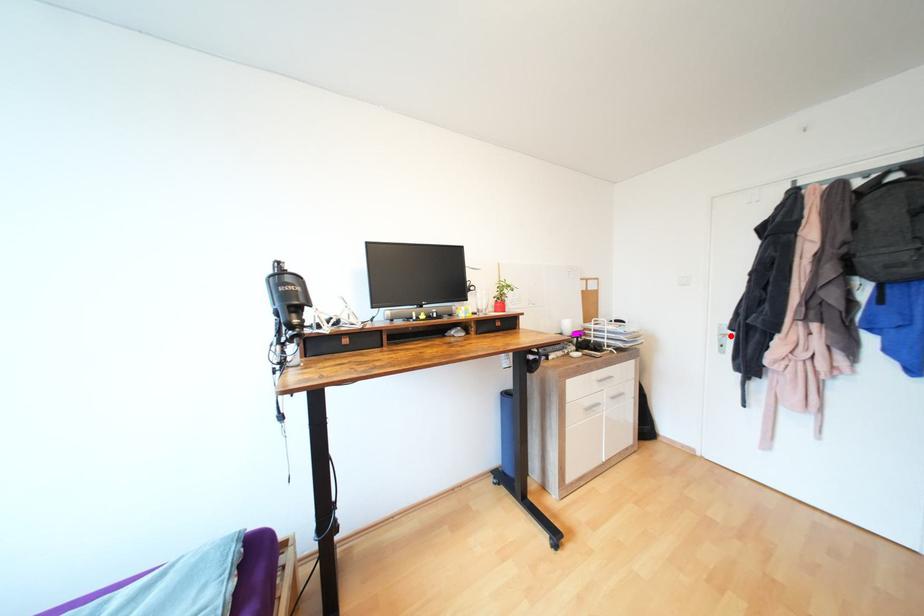
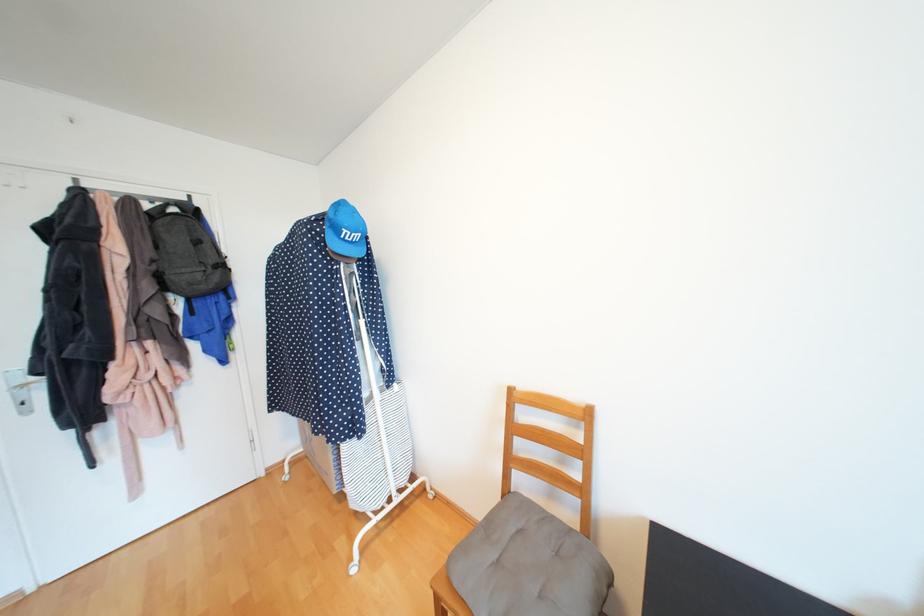
The point at the highlighted location is marked in the first image. Where is the corresponding point in the second image?

(30, 387)